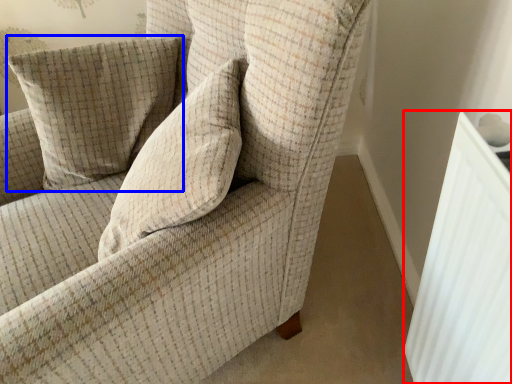
Question: Which point is closer to the camera, radiator (highlighted by a red box) or pillow (highlighted by a blue box)?

Choices:
 (A) radiator
 (B) pillow

Answer: (A)